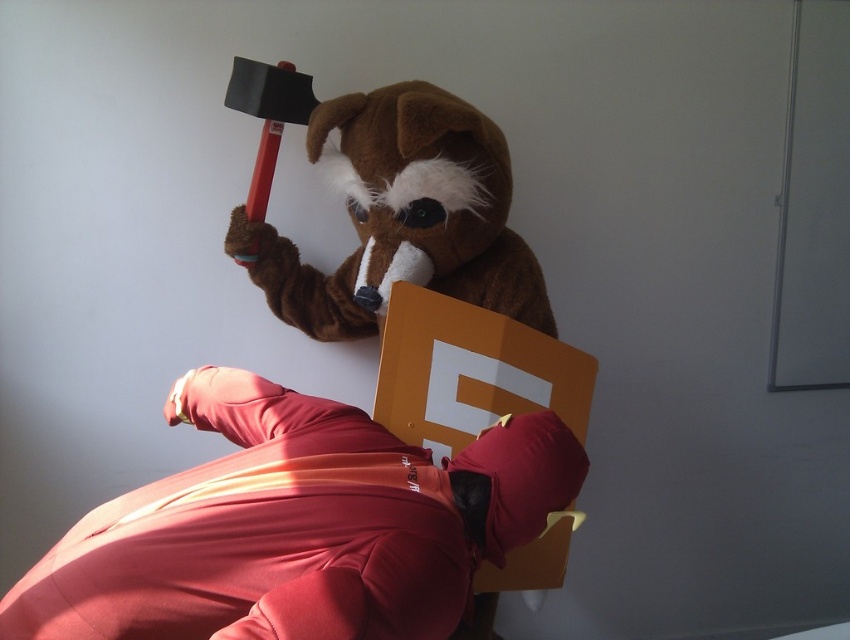
You are a photographer trying to capture a wide shot of the matte red tracksuit at center and the brown plush bear at upper center. Based on their sizes, which object should you position closer to the camera to ensure both fit in the frame?

Since the matte red tracksuit at center is wider than the brown plush bear at upper center, you should position the brown plush bear at upper center closer to the camera to ensure both fit in the frame.

You are a photographer setting up for a photoshoot in the room. You need to position a light source so that it illuminates both the matte red tracksuit at center and the brown plush bear at upper center equally. Based on their positions, where should you place the light source?

The matte red tracksuit at center is located below the brown plush bear at upper center. To illuminate both equally, place the light source directly above the brown plush bear at upper center so that the light can reach downward to the matte red tracksuit at center and evenly cover both subjects.

You are standing at the origin point in the room. There is a matte red tracksuit at center marked by point (298, 525). Which direction should you move to reach the red tracksuit?

The point (298, 525) marks the location of the matte red tracksuit at center, so moving towards that coordinate will lead you directly to the red tracksuit.